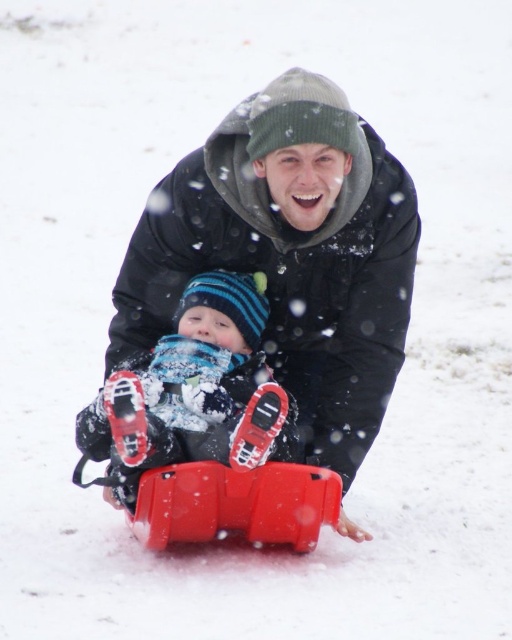
Question: Does matte black jacket at center appear on the right side of matte plastic sled at center?

Choices:
 (A) yes
 (B) no

Answer: (A)

Question: Does matte black jacket at center appear over matte plastic sled at center?

Choices:
 (A) yes
 (B) no

Answer: (A)

Question: Which point is closer to the camera taking this photo?

Choices:
 (A) (104, 451)
 (B) (367, 368)

Answer: (A)

Question: Which object is closer to the camera taking this photo?

Choices:
 (A) matte plastic sled at center
 (B) matte black jacket at center

Answer: (A)

Question: Which of the following is the closest to the observer?

Choices:
 (A) matte plastic sled at center
 (B) matte black jacket at center

Answer: (A)

Question: Does matte black jacket at center have a greater width compared to matte plastic sled at center?

Choices:
 (A) yes
 (B) no

Answer: (A)